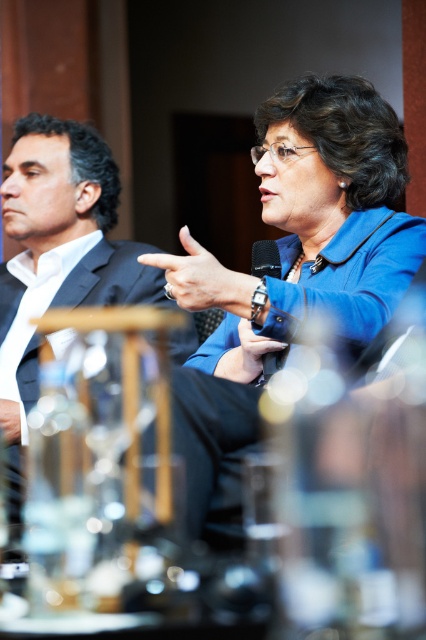
From the picture: You are standing in front of the two people in the formal setting. You want to place a small gift exactly halfway between the two points labeled point (80,248) and point (261,256). Will the gift be closer to the woman speaking into the microphone or the man listening?

The gift placed exactly halfway between point (80,248) and point (261,256) will be closer to the man listening because point (80,248) is closer to the camera than point (261,256), meaning the halfway point in space would still be nearer to the man who is positioned behind the woman in the scene.

In the formal setting described, where the woman is speaking into a microphone and the man in a suit is listening, can you determine the spatial relationship between the black suit at left and the black matte microphone at center based on their positions?

The black suit at left is positioned to the left of the black matte microphone at center.

You are organizing a small conference and need to ensure that the black suit at left and the black matte microphone at center can fit side by side on a 1.2 meter wide table. Based on their sizes, will they both fit?

Answer: The black suit at left is wider than the black matte microphone at center. Since the total width of both items combined would exceed 1.2 meters, they might not fit side by side on the table.